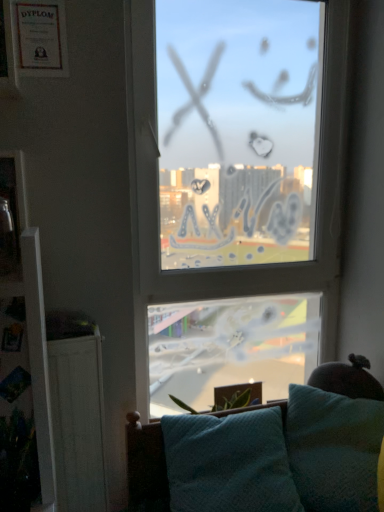
Question: Does matte paper frame at upper left, the second picture frame in the bottom-to-top sequence, have a larger size compared to transparent glass window at center?

Choices:
 (A) no
 (B) yes

Answer: (A)

Question: Would you say matte paper frame at upper left, positioned as the first picture frame in top-to-bottom order, is outside transparent glass window at center?

Choices:
 (A) yes
 (B) no

Answer: (A)

Question: From a real-world perspective, is matte paper frame at upper left, positioned as the first picture frame in top-to-bottom order, positioned over transparent glass window at center based on gravity?

Choices:
 (A) yes
 (B) no

Answer: (A)

Question: From the image's perspective, is matte paper frame at upper left, the 1th picture frame positioned from the back, on top of transparent glass window at center?

Choices:
 (A) yes
 (B) no

Answer: (A)

Question: Is matte paper frame at upper left, the second picture frame in the bottom-to-top sequence, not close to transparent glass window at center?

Choices:
 (A) yes
 (B) no

Answer: (B)

Question: From the image's perspective, relative to teal fabric pillow at lower right, is transparent glass window at center above or below?

Choices:
 (A) below
 (B) above

Answer: (B)

Question: In terms of height, does transparent glass window at center look taller or shorter compared to teal fabric pillow at lower right?

Choices:
 (A) short
 (B) tall

Answer: (B)

Question: In the image, is transparent glass window at center on the left side or the right side of teal fabric pillow at lower right?

Choices:
 (A) left
 (B) right

Answer: (A)

Question: Based on their sizes in the image, would you say transparent glass window at center is bigger or smaller than teal fabric pillow at lower right?

Choices:
 (A) big
 (B) small

Answer: (A)

Question: Do you think teal fabric pillow at lower right is within metallic glass picture frame at left, acting as the 2th picture frame starting from the back, or outside of it?

Choices:
 (A) outside
 (B) inside

Answer: (A)

Question: From the image's perspective, relative to metallic glass picture frame at left, the first picture frame positioned from the front, is teal fabric pillow at lower right above or below?

Choices:
 (A) below
 (B) above

Answer: (A)

Question: Looking at the image, does teal fabric pillow at lower right seem bigger or smaller compared to metallic glass picture frame at left, which is counted as the 1th picture frame, starting from the bottom?

Choices:
 (A) small
 (B) big

Answer: (B)

Question: Visually, is teal fabric pillow at lower right positioned to the left or to the right of metallic glass picture frame at left, which appears as the second picture frame when viewed from the top?

Choices:
 (A) left
 (B) right

Answer: (B)

Question: Which is correct: transparent glass window at center is inside teal fabric studio couch at lower center, or outside of it?

Choices:
 (A) outside
 (B) inside

Answer: (A)

Question: Does point (190, 275) appear closer or farther from the camera than point (127, 471)?

Choices:
 (A) farther
 (B) closer

Answer: (A)